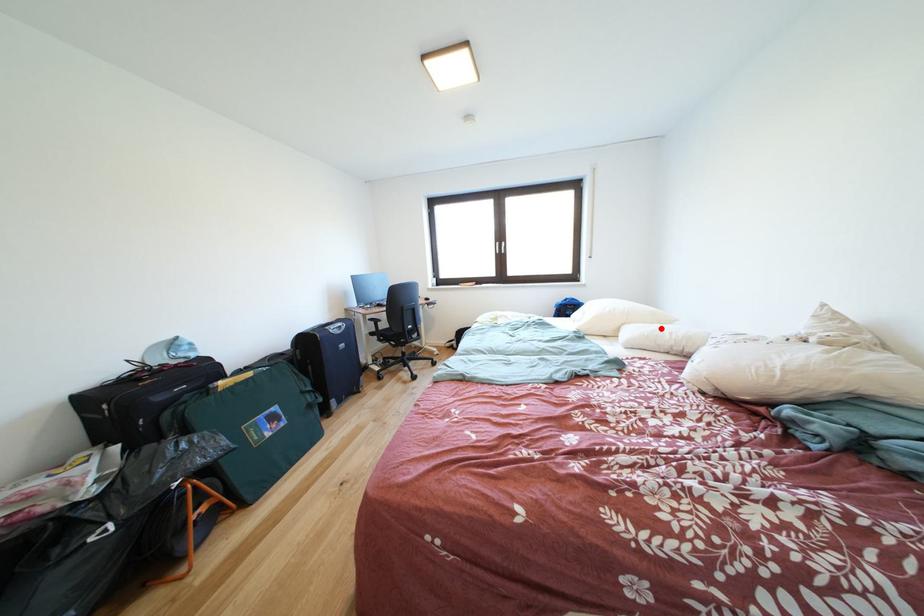
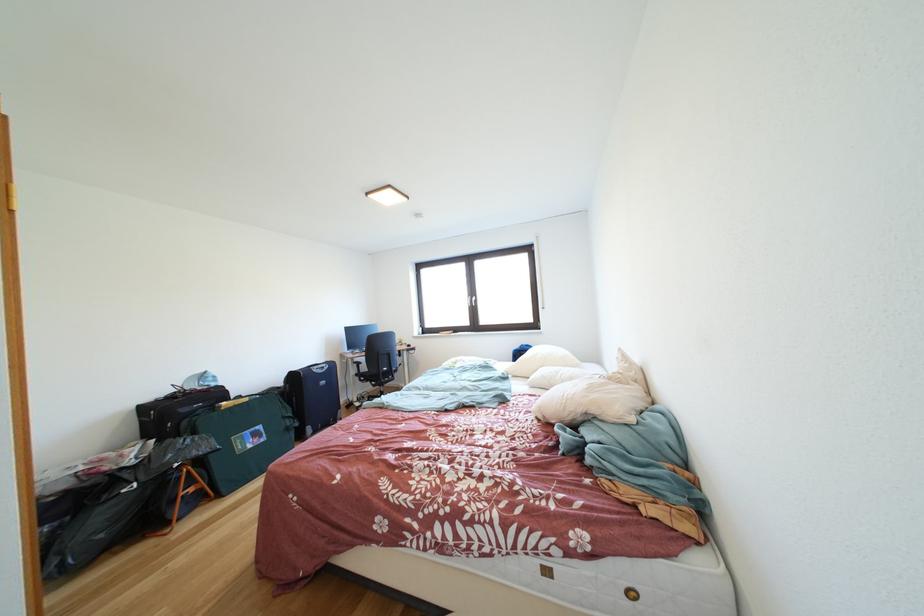
The point at the highlighted location is marked in the first image. Where is the corresponding point in the second image?

(570, 371)